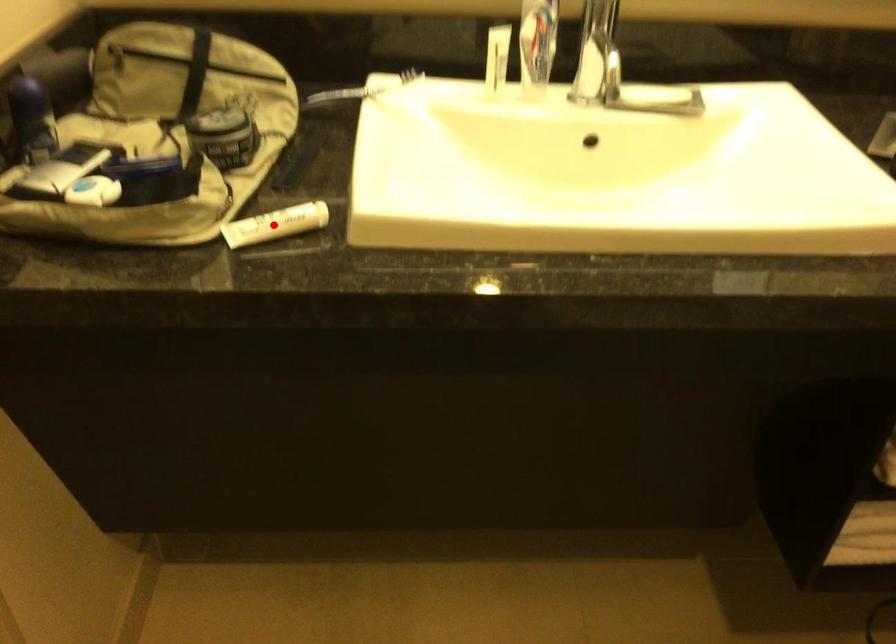
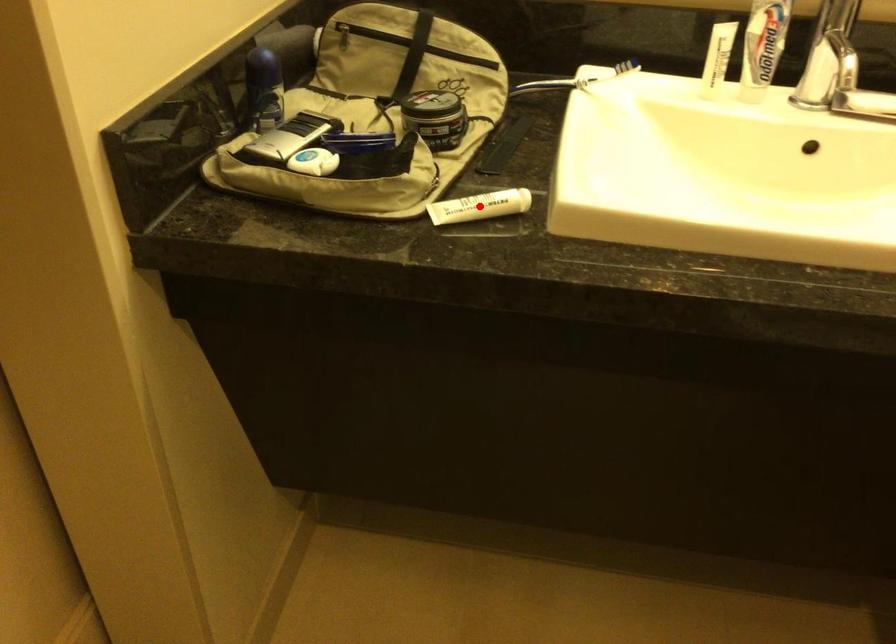
I am providing you with two images of the same scene from different viewpoints. A red point is marked on the first image and another point is marked on the second image. Does the point marked in image1 correspond to the same location as the one in image2?

No